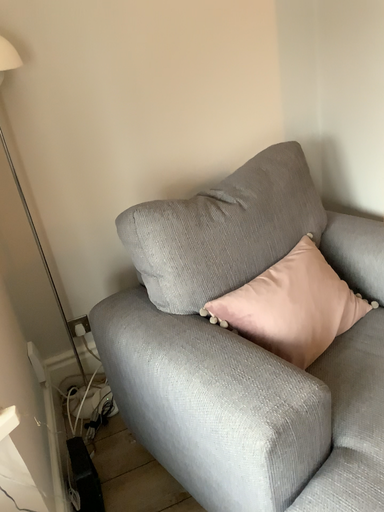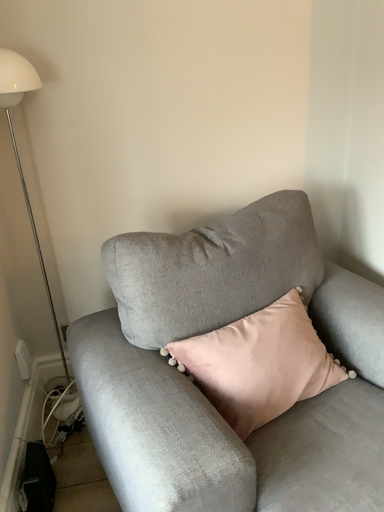
Question: Which way did the camera rotate in the video?

Choices:
 (A) rotated right
 (B) rotated left

Answer: (B)